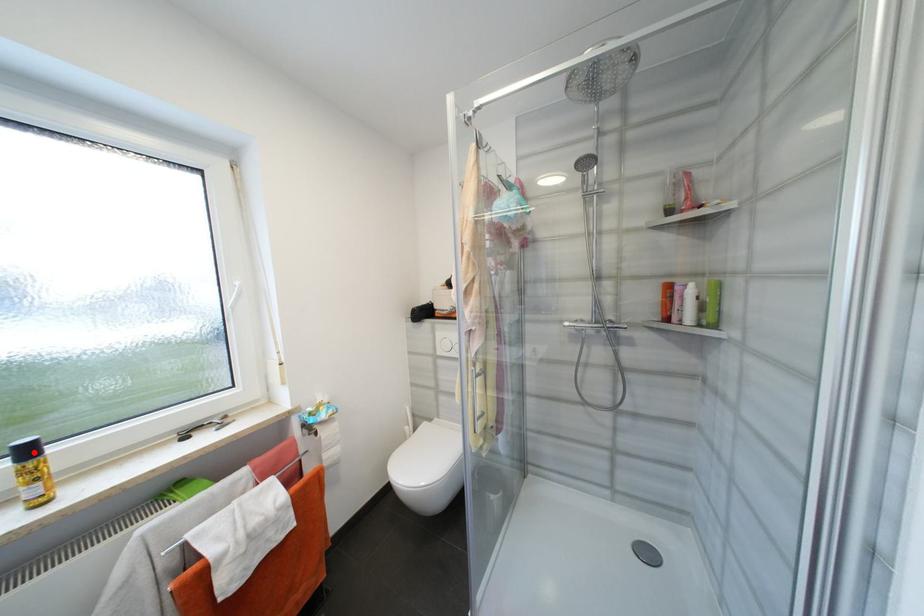
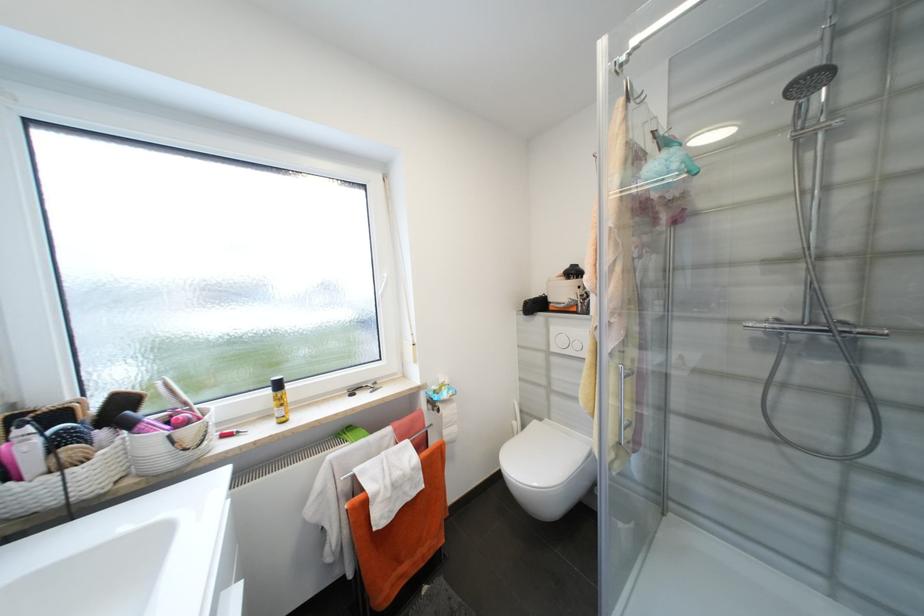
The point at the highlighted location is marked in the first image. Where is the corresponding point in the second image?

(284, 386)